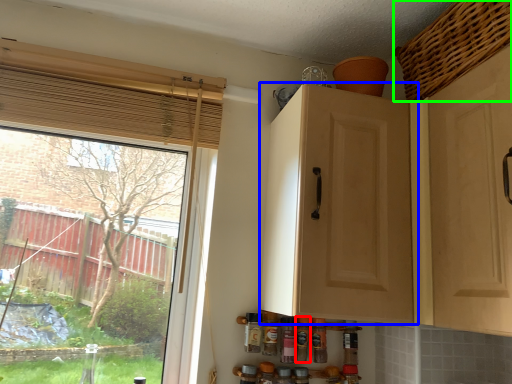
Question: Based on their relative distances, which object is farther from bottle (highlighted by a red box)? Choose from cabinetry (highlighted by a blue box) and basket (highlighted by a green box).

Choices:
 (A) cabinetry
 (B) basket

Answer: (B)